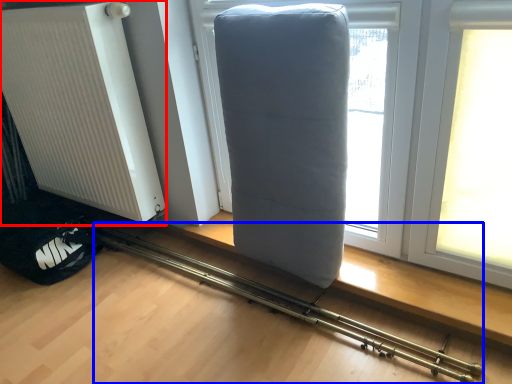
Question: Which object is further to the camera taking this photo, radiator (highlighted by a red box) or equipment (highlighted by a blue box)?

Choices:
 (A) radiator
 (B) equipment

Answer: (A)